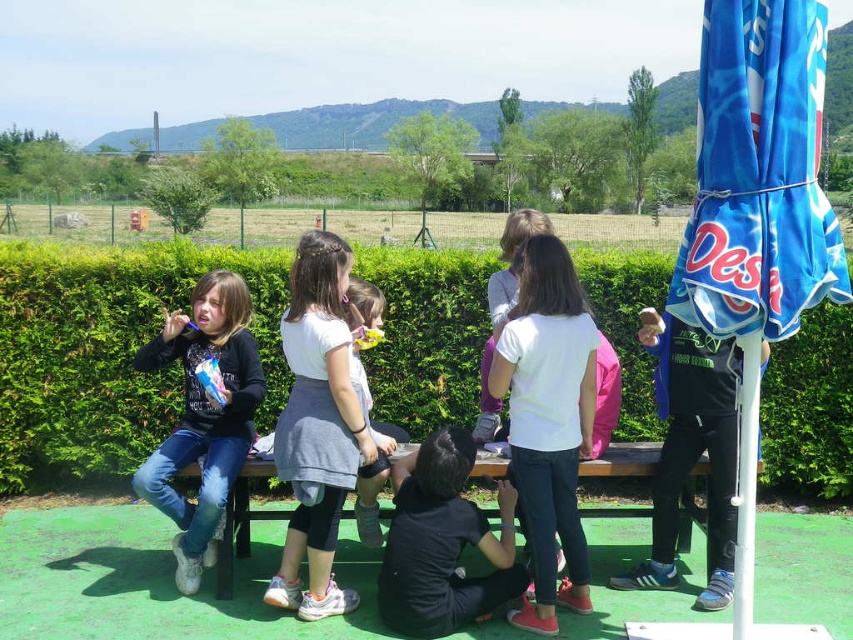
Question: Is green leafy hedge at center smaller than light pink fabric dress at center?

Choices:
 (A) yes
 (B) no

Answer: (B)

Question: Which of the following is the farthest from the observer?

Choices:
 (A) (579, 433)
 (B) (374, 518)

Answer: (B)

Question: Which point is farther from the camera taking this photo?

Choices:
 (A) (635, 449)
 (B) (373, 493)
 (C) (51, 458)
 (D) (326, 522)

Answer: (C)

Question: Is white matte shirt at center to the right of white cotton shirt at center from the viewer's perspective?

Choices:
 (A) no
 (B) yes

Answer: (B)

Question: Is white matte shirt at center above light pink fabric dress at center?

Choices:
 (A) no
 (B) yes

Answer: (B)

Question: Which point is farther from the camera taking this photo?

Choices:
 (A) (234, 388)
 (B) (320, 396)
 (C) (554, 269)
 (D) (374, 524)

Answer: (D)